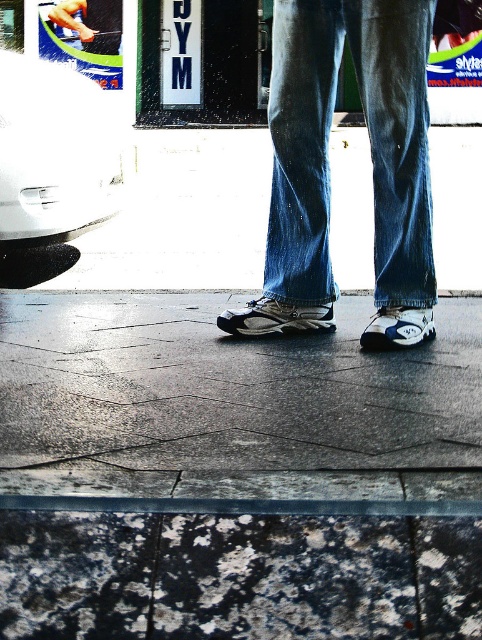
Which is behind, point (62, 122) or point (392, 339)?

The point (62, 122) is more distant.

Does point (103, 120) come in front of point (433, 324)?

No, it is not.

Find the location of a particular element. The width and height of the screenshot is (482, 640). white glossy car at left is located at coordinates (53, 152).

Which is more to the left, blue denim jeans at center or white glossy car at left?

Positioned to the left is white glossy car at left.

Which is in front, point (377, 26) or point (77, 138)?

Point (377, 26) is in front.

Find the location of a particular element. The height and width of the screenshot is (640, 482). blue denim jeans at center is located at coordinates (370, 145).

Which of these two, white mesh shoe at center or white synthetic sneaker at center, stands shorter?

Standing shorter between the two is white mesh shoe at center.

Can you confirm if white mesh shoe at center is smaller than white synthetic sneaker at center?

Yes, white mesh shoe at center is smaller than white synthetic sneaker at center.

Who is more forward, (x=241, y=310) or (x=383, y=339)?

Point (x=383, y=339) is more forward.

Where is `white mesh shoe at center`? The height and width of the screenshot is (640, 482). white mesh shoe at center is located at coordinates (276, 317).